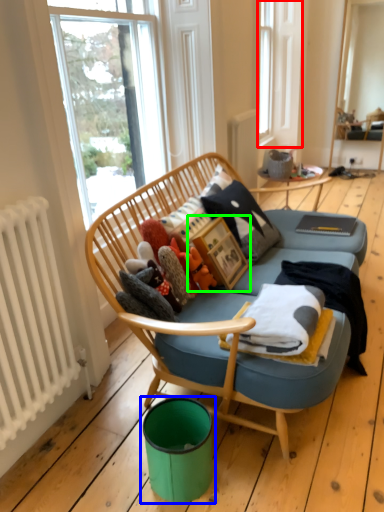
Question: Which is farther away from bay window (highlighted by a red box)? teal (highlighted by a blue box) or picture frame (highlighted by a green box)?

Choices:
 (A) teal
 (B) picture frame

Answer: (A)